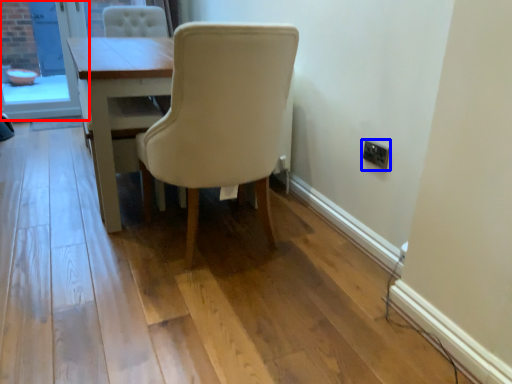
Question: Among these objects, which one is farthest to the camera, screen door (highlighted by a red box) or electric outlet (highlighted by a blue box)?

Choices:
 (A) screen door
 (B) electric outlet

Answer: (A)